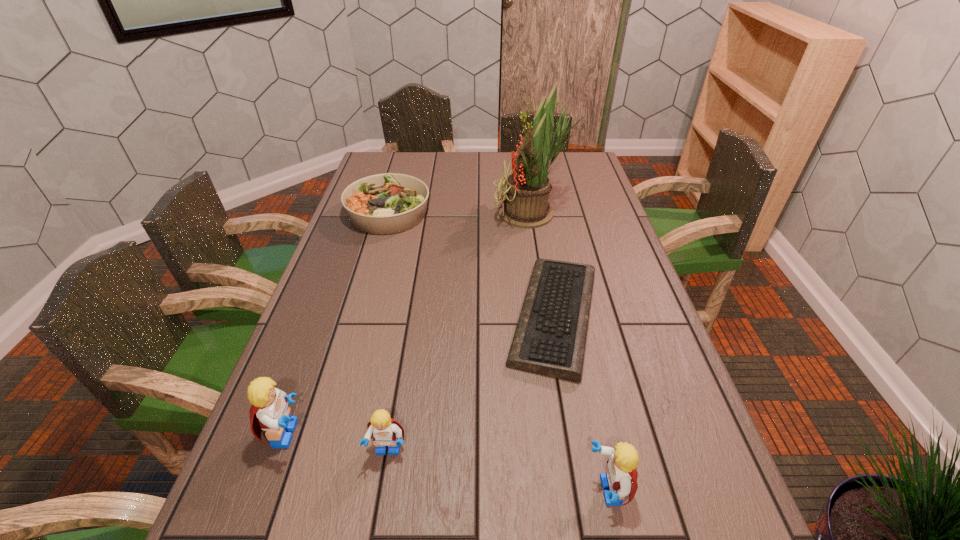
If the aim is uniform spacing by inserting an additional Lego among them, please point to a vacant space for this new Lego. Please provide its 2D coordinates. Your answer should be formatted as a tuple, i.e. [(x, y)], where the tuple contains the x and y coordinates of a point satisfying the conditions above.

[(494, 470)]